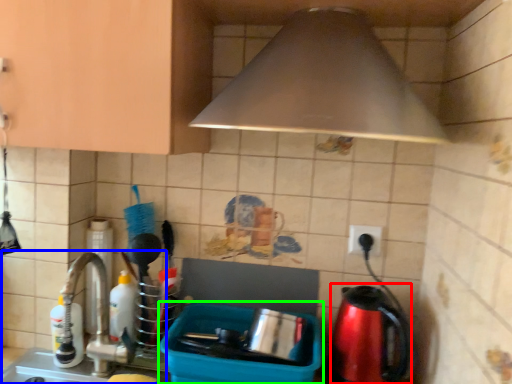
Question: Which is nearer to the coffeepot (highlighted by a red box)? sink (highlighted by a blue box) or appliance (highlighted by a green box).

Choices:
 (A) sink
 (B) appliance

Answer: (B)